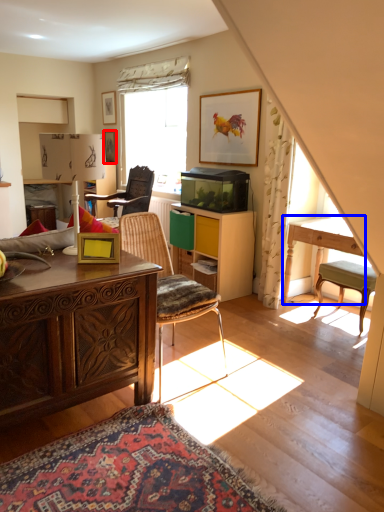
Question: Which object is closer to the camera taking this photo, picture frame (highlighted by a red box) or table (highlighted by a blue box)?

Choices:
 (A) picture frame
 (B) table

Answer: (B)